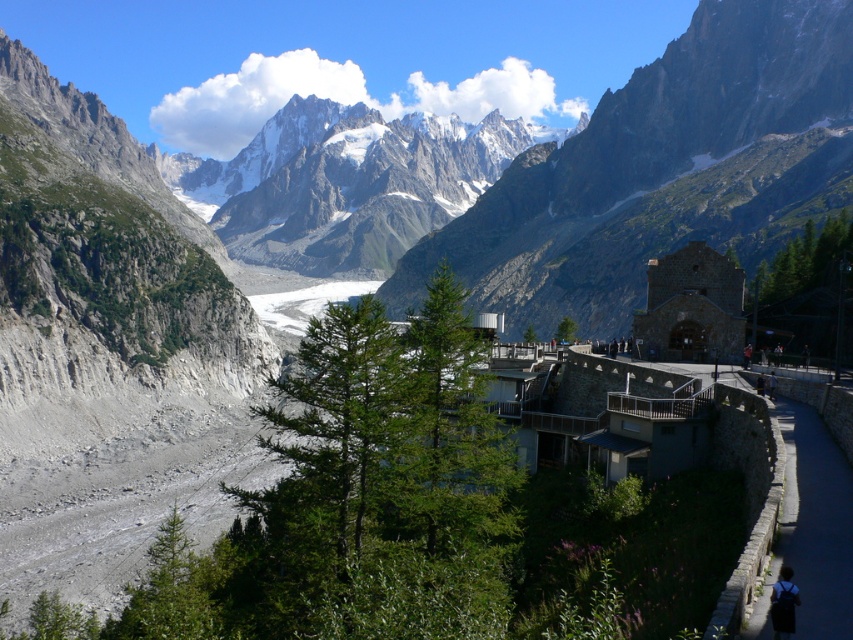
You are standing at the stone structure and want to walk towards the point marked as point (468,280). Which direction should you go relative to the point marked as point (837,516)?

You should walk towards the point marked as point 0.438, 0550 in the direction opposite to point (837,516) since point (468,280) is closer to you than point (837,516).

You are standing at point (808, 22) and want to reach the stone structure on the right. The path is 691.31 feet long. If you walk at 3 feet per second, how many seconds will it take you to reach the stone structure?

The path between you and the stone structure is 691.31 feet long. At a walking speed of 3 feet per second, it will take approximately 230.43 seconds to reach the stone structure.